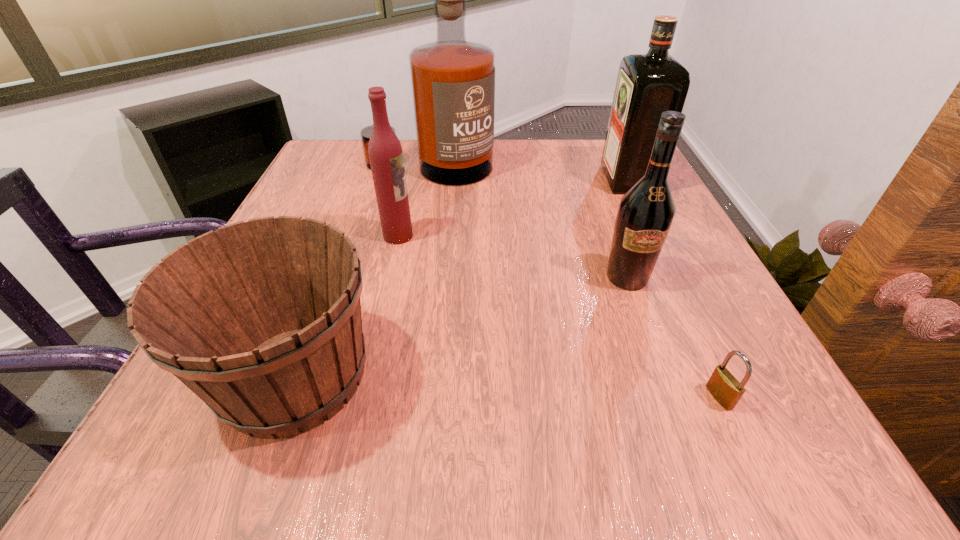
The image size is (960, 540). Find the location of `wine bottle situated at the right edge`. wine bottle situated at the right edge is located at coordinates (645, 214).

Where is `padlock that is positioned at the right edge`? This screenshot has width=960, height=540. padlock that is positioned at the right edge is located at coordinates (724, 387).

Where is `object located at the far left corner`? object located at the far left corner is located at coordinates (453, 80).

Image resolution: width=960 pixels, height=540 pixels. I want to click on object located in the near left corner section of the desktop, so click(x=261, y=319).

The image size is (960, 540). In order to click on object positioned at the far right corner in this screenshot , I will do point(647,85).

You are a GUI agent. You are given a task and a screenshot of the screen. Output one action in this format:
    pyautogui.click(x=<x>, y=<y>)
    Task: Click on the object positioned at the near right corner
    The height and width of the screenshot is (540, 960).
    Given the screenshot: What is the action you would take?
    click(724, 387)

In the image, there is a desktop. Identify the location of vacant space at the far edge. This screenshot has height=540, width=960. (517, 142).

The height and width of the screenshot is (540, 960). I want to click on vacant area at the left edge, so click(x=331, y=206).

This screenshot has width=960, height=540. In order to click on free space at the right edge of the desktop in this screenshot , I will do `click(603, 222)`.

This screenshot has width=960, height=540. In the image, there is a desktop. What are the coordinates of `vacant space at the far left corner` in the screenshot? It's located at (357, 158).